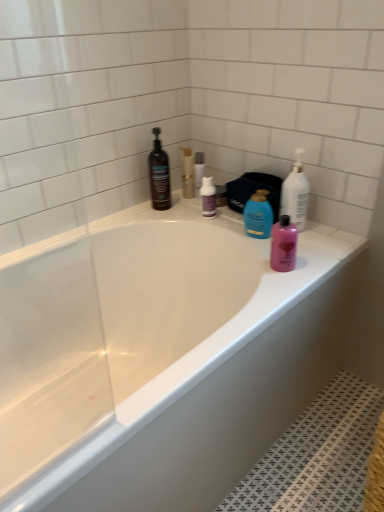
At what (x,y) coordinates should I click in order to perform the action: click on free space between blue glossy bottle at upper center, placed as the 3th cleaning product when sorted from left to right, and purple matte bottle at center, which is the 2th cleaning product in left-to-right order. Please return your answer as a coordinate pair (x, y). Looking at the image, I should click on (226, 222).